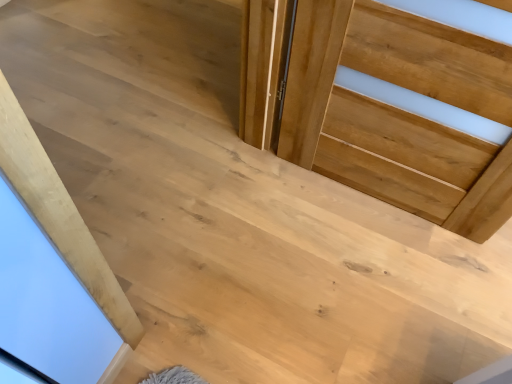
Identify the location of natural wood chest of drawers at right. This screenshot has width=512, height=384. (400, 112).

Image resolution: width=512 pixels, height=384 pixels. Describe the element at coordinates (400, 112) in the screenshot. I see `natural wood chest of drawers at right` at that location.

What are the coordinates of `natural wood chest of drawers at right` in the screenshot? It's located at (400, 112).